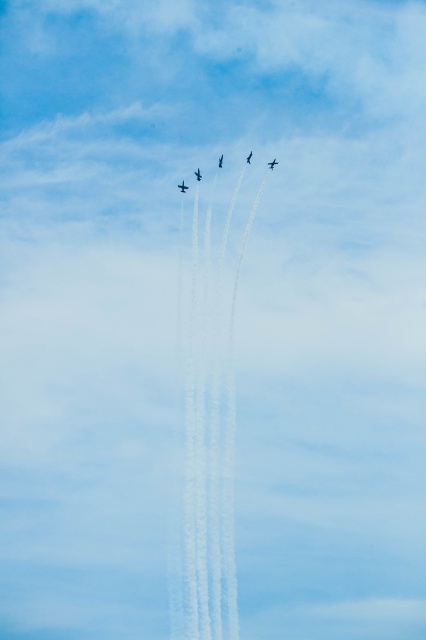
Question: Is shiny silver jet at center above shiny silver jet at upper center?

Choices:
 (A) yes
 (B) no

Answer: (B)

Question: Which object appears farthest from the camera in this image?

Choices:
 (A) shiny silver jet at upper center
 (B) white vapor trails at center
 (C) shiny silver airplane at upper center

Answer: (A)

Question: From the image, what is the correct spatial relationship of shiny black airplane at center in relation to shiny silver jet at center?

Choices:
 (A) left
 (B) right

Answer: (B)

Question: Considering the relative positions of shiny silver airplane at upper center and shiny black airplane at center in the image provided, where is shiny silver airplane at upper center located with respect to shiny black airplane at center?

Choices:
 (A) above
 (B) below

Answer: (B)

Question: Which point appears closest to the camera in this image?

Choices:
 (A) (184, 188)
 (B) (221, 164)
 (C) (195, 172)
 (D) (210, 474)

Answer: (A)

Question: Which point is closer to the camera?

Choices:
 (A) (201, 177)
 (B) (230, 547)
 (C) (247, 163)
 (D) (221, 156)

Answer: (A)